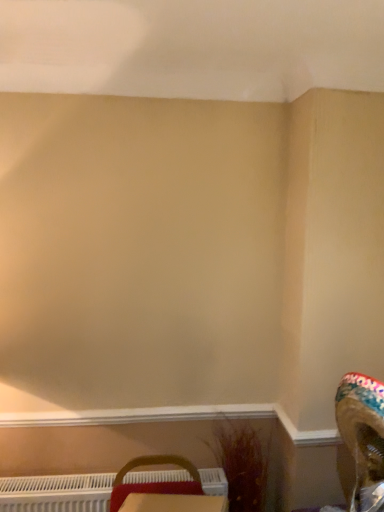
Locate an element on the screen. This screenshot has height=512, width=384. white smooth window sill at lower center is located at coordinates (136, 415).

The height and width of the screenshot is (512, 384). What do you see at coordinates (136, 415) in the screenshot?
I see `white smooth window sill at lower center` at bounding box center [136, 415].

In order to face white smooth window sill at lower center, should I rotate leftwards or rightwards?

Rotate left and turn 6.721 degrees.

Locate an element on the screen. white smooth window sill at lower center is located at coordinates (136, 415).